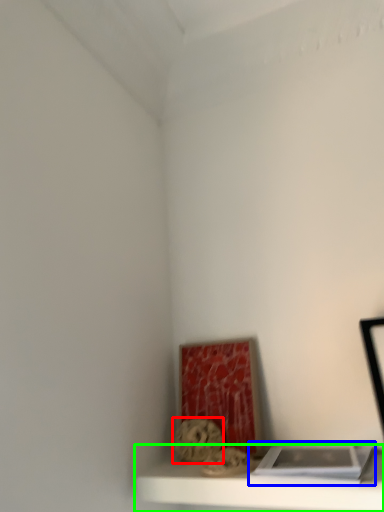
Question: Based on their relative distances, which object is farther from art (highlighted by a red box)? Choose from book (highlighted by a blue box) and shelf (highlighted by a green box).

Choices:
 (A) book
 (B) shelf

Answer: (A)